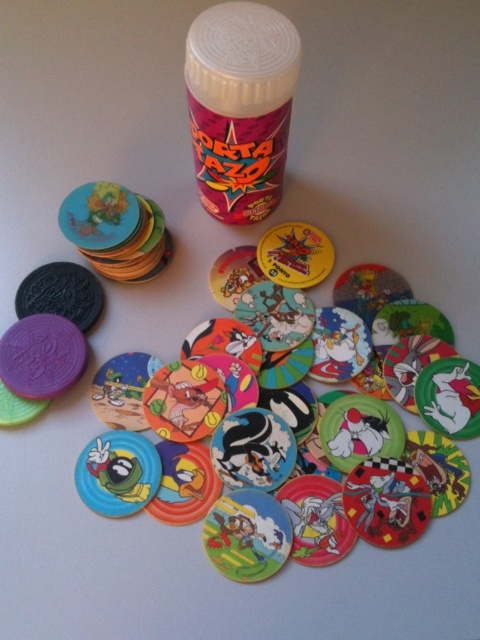
Question: Does matte plastic bottle at center have a lesser width compared to matte plastic disc at center?

Choices:
 (A) no
 (B) yes

Answer: (B)

Question: Which of the following is the farthest from the observer?

Choices:
 (A) matte plastic bottle at center
 (B) matte plastic disc at center

Answer: (B)

Question: Does matte plastic bottle at center have a greater width compared to matte plastic disc at center?

Choices:
 (A) yes
 (B) no

Answer: (B)

Question: Can you confirm if matte plastic bottle at center is positioned above matte plastic disc at center?

Choices:
 (A) no
 (B) yes

Answer: (B)

Question: Which point is farther from the camera taking this photo?

Choices:
 (A) (218, 209)
 (B) (245, 580)

Answer: (A)

Question: Which object is farther from the camera taking this photo?

Choices:
 (A) matte plastic bottle at center
 (B) matte plastic disc at center

Answer: (B)